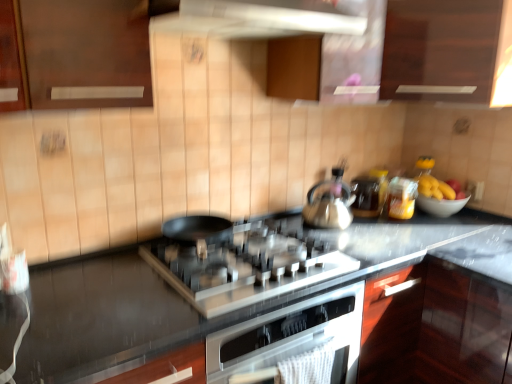
Find the location of a particular element. Image resolution: width=512 pixels, height=384 pixels. vacant region to the left of matte yellow jar at upper right, the 2th appliance in the left-to-right sequence is located at coordinates (373, 223).